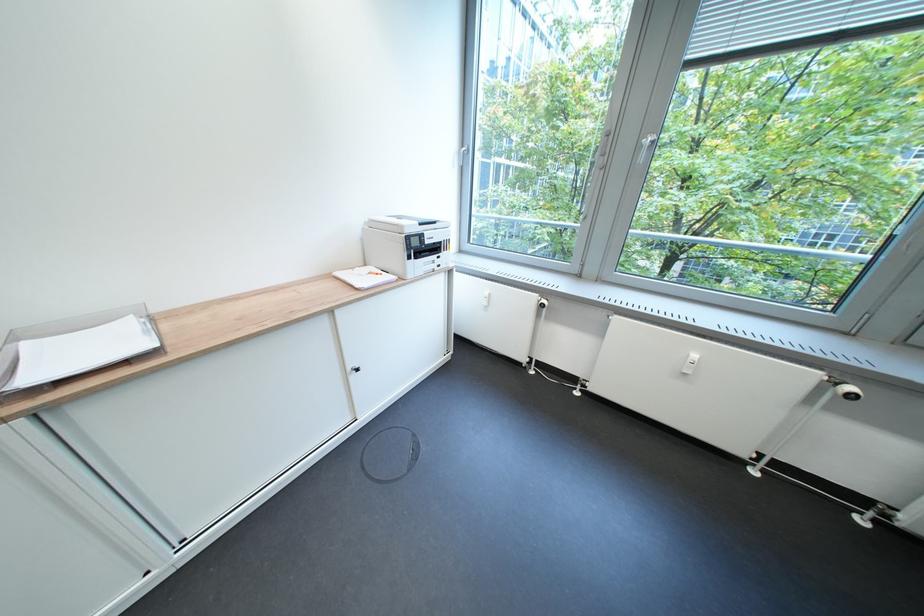
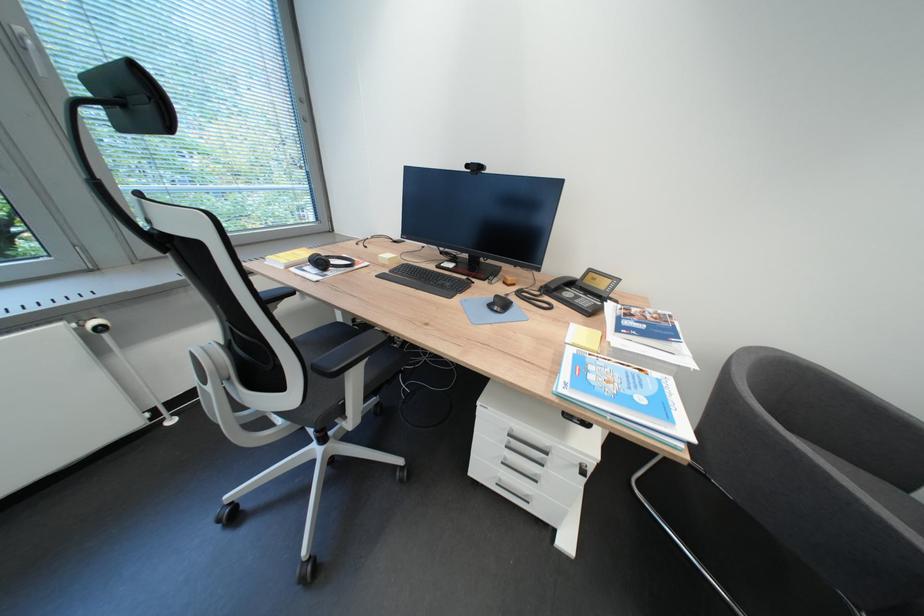
Find the pixel in the second image that matches point 862,390 in the first image.

(106, 325)